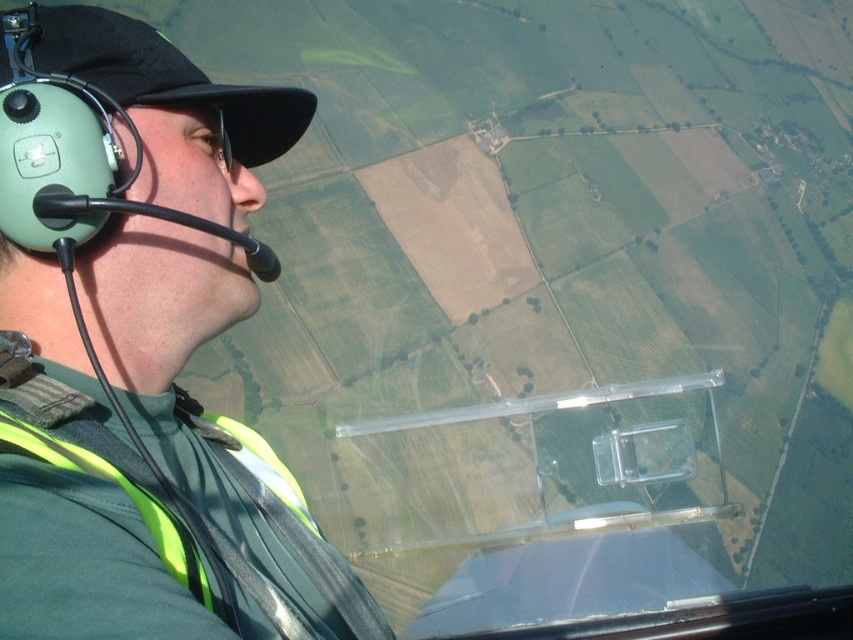
How distant is green matte helmet at upper left from neon yellow reflective safety vest at left?

green matte helmet at upper left is 3.53 inches from neon yellow reflective safety vest at left.

Is point (19, 202) closer to camera compared to point (184, 480)?

Yes, it is in front of point (184, 480).

This screenshot has height=640, width=853. Find the location of `green matte helmet at upper left`. green matte helmet at upper left is located at coordinates 140,349.